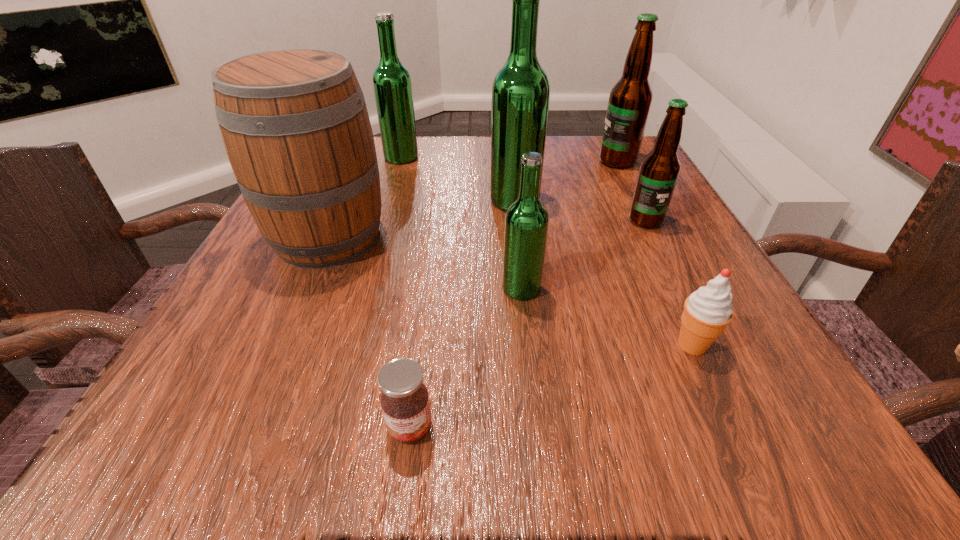
The height and width of the screenshot is (540, 960). Find the location of `free region at the near left corner of the desktop`. free region at the near left corner of the desktop is located at coordinates (262, 411).

Locate an element on the screen. Image resolution: width=960 pixels, height=540 pixels. blank space at the far right corner of the desktop is located at coordinates (588, 183).

This screenshot has width=960, height=540. Find the location of `empty space between the second farthest green beer bottle and the seventh tallest object`. empty space between the second farthest green beer bottle and the seventh tallest object is located at coordinates (604, 272).

The height and width of the screenshot is (540, 960). I want to click on vacant area between the tallest beer bottle and the nearer brown beer bottle, so click(x=580, y=210).

Identify the location of vacant space that is in between the bigger brown beer bottle and the cider. (x=472, y=199).

Image resolution: width=960 pixels, height=540 pixels. I want to click on vacant point located between the icecream and the nearer brown beer bottle, so click(x=669, y=283).

You are a GUI agent. You are given a task and a screenshot of the screen. Output one action in this format:
    pyautogui.click(x=<x>, y=<y>)
    Task: Click on the vacant area between the leftmost beer bottle and the seventh farthest object
    The image size is (960, 540).
    Given the screenshot: What is the action you would take?
    pyautogui.click(x=547, y=251)

Find the location of a particular element. This screenshot has width=960, height=540. object that stands as the seventh closest to the second shortest object is located at coordinates (392, 84).

Identify which object is the fourth closest to the second shortest object. Please provide its 2D coordinates. Your answer should be formatted as a tuple, i.e. [(x, y)], where the tuple contains the x and y coordinates of a point satisfying the conditions above.

[(521, 89)]

Point out which beer bottle is positioned as the fourth nearest to the jam. Please provide its 2D coordinates. Your answer should be formatted as a tuple, i.e. [(x, y)], where the tuple contains the x and y coordinates of a point satisfying the conditions above.

[(392, 84)]